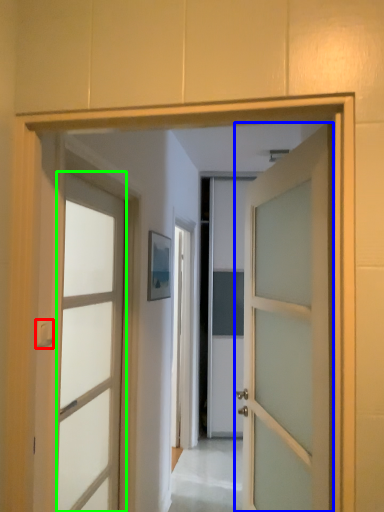
Question: Based on their relative distances, which object is farther from door handle (highlighted by a red box)? Choose from door (highlighted by a blue box) and door (highlighted by a green box).

Choices:
 (A) door
 (B) door

Answer: (A)